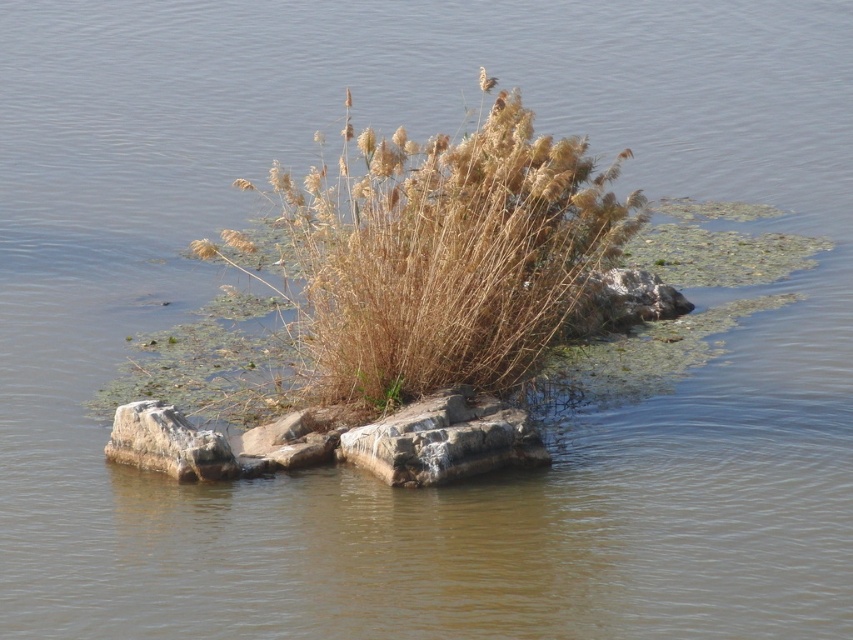
You are standing on the edge of the island and want to place a small potted plant exactly at the point marked by point (444, 440). Based on the scene description, what type of surface will the potted plant be placed on?

The point (444, 440) indicates gray weathered stone at center, so the potted plant will be placed on the gray weathered stone at center.